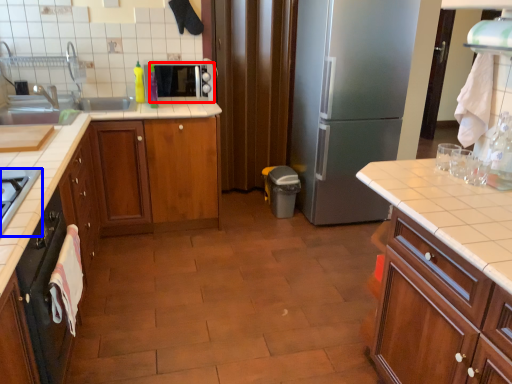
Question: Which object appears farthest to the camera in this image, appliance (highlighted by a red box) or gas stove (highlighted by a blue box)?

Choices:
 (A) appliance
 (B) gas stove

Answer: (A)